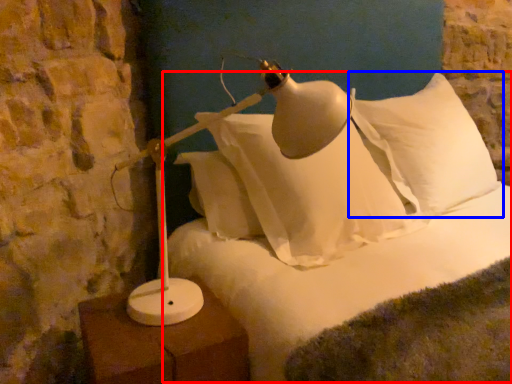
Question: Among these objects, which one is farthest to the camera, bed (highlighted by a red box) or pillow (highlighted by a blue box)?

Choices:
 (A) bed
 (B) pillow

Answer: (B)